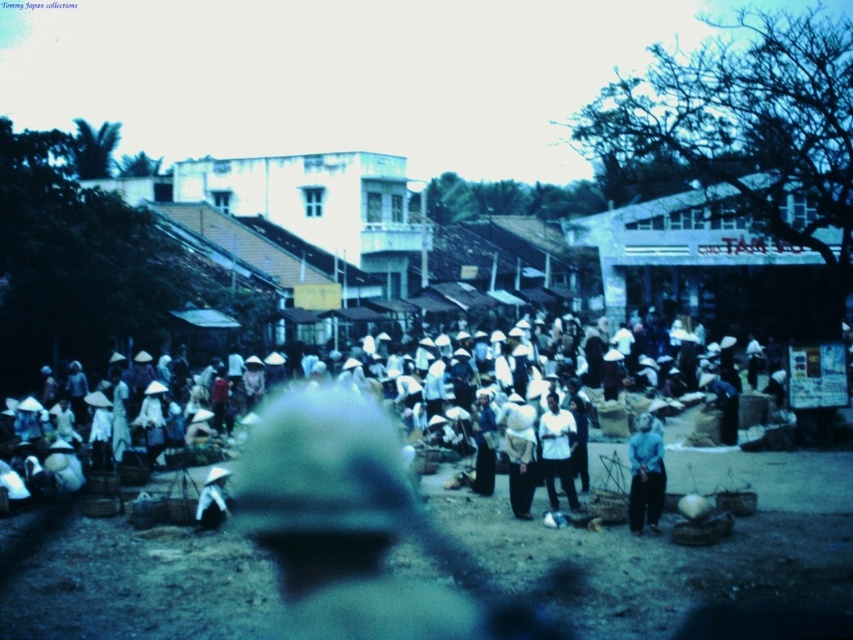
You are a photographer trying to capture a detailed shot of the white fabric at center and the white matte shirt at center in this vintage market scene. Since the camera focuses on the closest object, which item will be in focus?

The white fabric at center will be in focus because it is larger in size than the white matte shirt at center, indicating it is closer to the camera.

You are a photographer trying to capture a clear shot of the white fabric at center and the white straw hat at center in this vintage market scene. Since the foreground is blurred, which object would appear more prominent in your photo if you focus on the center?

The white fabric at center appears more prominent because it has a larger size compared to the white straw hat at center.

You are a photographer trying to capture a clear image of the white matte shirt at center and the white fabric at center in the market scene. Since the foreground is blurred, which object should you focus on to ensure it appears sharp in the photo?

The white fabric at center is to the left of the white matte shirt at center. Since the foreground is blurred, focusing on the white matte shirt at center would be better because it is closer to the background where the market activity is clearer, while the foreground objects are blurred.